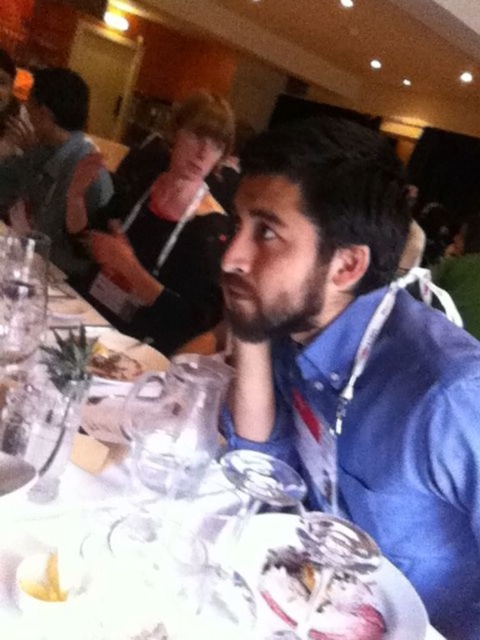
Which is more to the right, blue fabric shirt at center or brown crumbly cake at lower left?

brown crumbly cake at lower left

Which of these two, blue fabric shirt at center or brown crumbly cake at lower left, stands taller?

blue fabric shirt at center is taller.

Between point (172, 320) and point (108, 356), which one is positioned in front?

Point (108, 356)

Locate an element on the screen. blue fabric shirt at center is located at coordinates (168, 236).

Which is in front, point (67, 236) or point (375, 618)?

Positioned in front is point (375, 618).

Locate an element on the screen. The width and height of the screenshot is (480, 640). matte black shirt at upper left is located at coordinates (49, 161).

Between matte black shirt at upper left and brown crumbly cake at lower left, which one is positioned higher?

matte black shirt at upper left is above.

Does matte black shirt at upper left have a smaller size compared to brown crumbly cake at lower left?

No.

Who is more distant from viewer, (51, 97) or (96, 358)?

Positioned behind is point (51, 97).

What are the coordinates of `matte black shirt at upper left` in the screenshot? It's located at (49, 161).